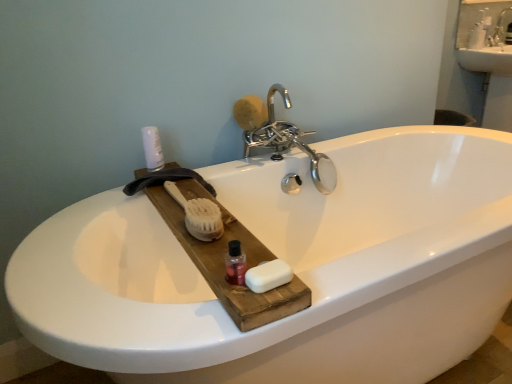
Question: From a real-world perspective, is white natural wood brush at center physically located above or below chrome metallic faucet at upper center?

Choices:
 (A) above
 (B) below

Answer: (A)

Question: From the image's perspective, is white natural wood brush at center positioned above or below chrome metallic faucet at upper center?

Choices:
 (A) below
 (B) above

Answer: (A)

Question: Which object is positioned farthest from the white natural wood brush at center?

Choices:
 (A) white matte spray can at upper left
 (B) chrome metallic faucet at upper center
 (C) white matte soap at center, the second soap when ordered from top to bottom
 (D) translucent plastic bottle at center
 (E) yellow sponge at upper center, which ranks as the 1th soap in top-to-bottom order

Answer: (E)

Question: Which object is the farthest from the white matte spray can at upper left?

Choices:
 (A) chrome metallic faucet at upper center
 (B) white natural wood brush at center
 (C) yellow sponge at upper center, marked as the second soap in a bottom-to-top arrangement
 (D) translucent plastic bottle at center
 (E) white matte soap at center, positioned as the first soap in front-to-back order

Answer: (E)